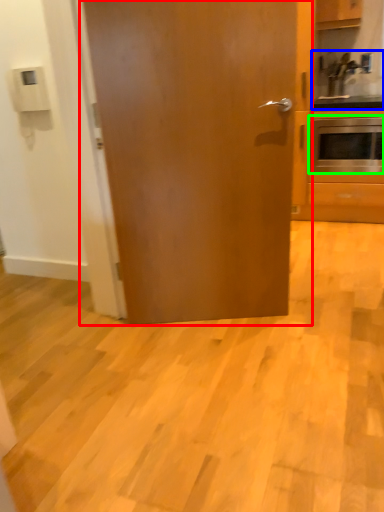
Question: Which object is positioned closest to door (highlighted by a red box)? Select from sink (highlighted by a blue box) and oven (highlighted by a green box).

Choices:
 (A) sink
 (B) oven

Answer: (B)